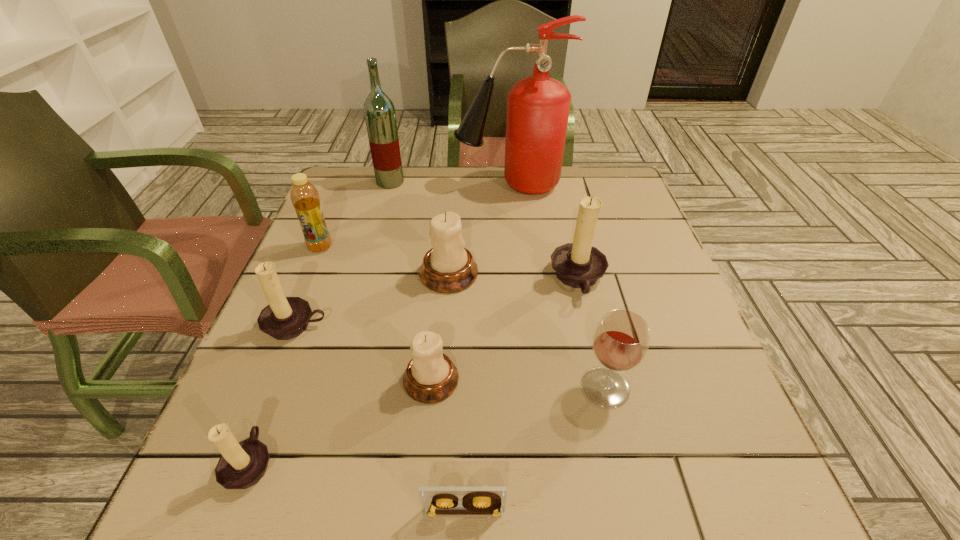
Find the location of `wineglass`. wineglass is located at coordinates (620, 342).

This screenshot has width=960, height=540. Find the location of `the nearer white candle holder`. the nearer white candle holder is located at coordinates (430, 377).

You are a GUI agent. You are given a task and a screenshot of the screen. Output one action in this format:
    pyautogui.click(x=<x>, y=<y>)
    Task: Click on the second nearest candle holder
    Image resolution: width=960 pixels, height=540 pixels.
    Given the screenshot: What is the action you would take?
    pyautogui.click(x=430, y=377)

Identify the location of the second nearest object. (242, 465).

Find the location of a particular element. This screenshot has width=960, height=540. the nearest brown candle holder is located at coordinates (242, 465).

At what (x,y) coordinates should I click in order to perform the action: click on videotape. Please return your answer as a coordinate pair (x, y). Looking at the image, I should click on (436, 500).

Where is `brown videotape`? This screenshot has height=540, width=960. brown videotape is located at coordinates (436, 500).

The height and width of the screenshot is (540, 960). I want to click on vacant space located 0.090m with the nozzle aimed from the red fire extinguisher, so click(425, 185).

I want to click on vacant space situated 0.290m with the nozzle aimed from the red fire extinguisher, so click(x=356, y=185).

Locate an element on the screen. free spot located 0.170m with the nozzle aimed from the red fire extinguisher is located at coordinates (397, 185).